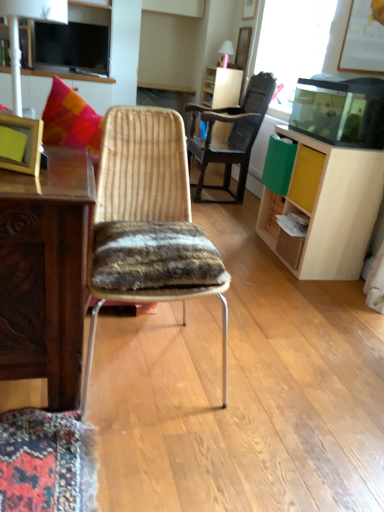
Find the location of a particular element. The height and width of the screenshot is (512, 384). free space underneath woven wood chair at center, acting as the 1th chair starting from the front (from a real-world perspective) is located at coordinates (155, 362).